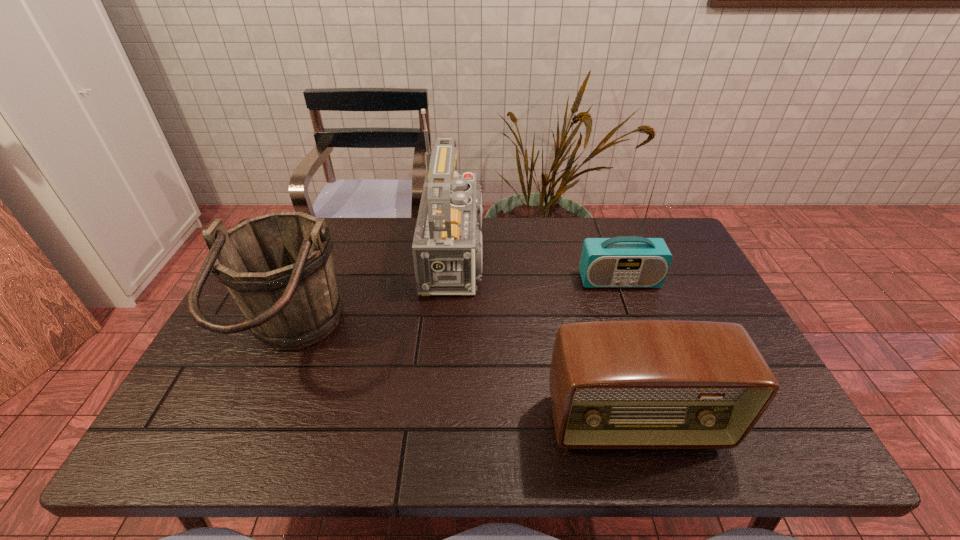
Find the location of a particular element. vacant space that satisfies the following two spatial constraints: 1. on the front panel of the second shortest radio receiver; 2. on the handle side of the bucket is located at coordinates (640, 338).